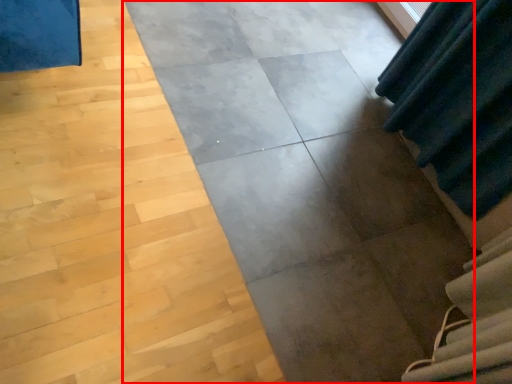
Question: From the image's perspective, what is the correct spatial positioning of concrete (annotated by the red box) in reference to stairwell?

Choices:
 (A) below
 (B) above

Answer: (B)